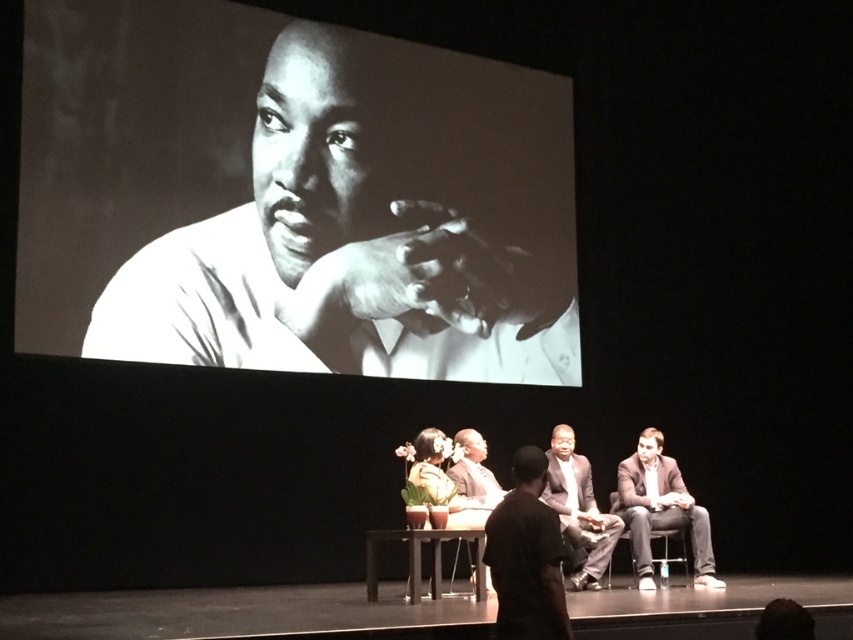
Question: Among these points, which one is farthest from the camera?

Choices:
 (A) (347, 230)
 (B) (697, 529)
 (C) (651, 532)
 (D) (556, 465)

Answer: (A)

Question: Observing the image, what is the correct spatial positioning of light brown leather jacket at lower right in reference to black fabric chair at lower right?

Choices:
 (A) left
 (B) right

Answer: (A)

Question: Does black matte shirt at center appear on the right side of dark brown suit at center?

Choices:
 (A) no
 (B) yes

Answer: (B)

Question: Can you confirm if black matte shirt at center is positioned to the right of dark brown suit at center?

Choices:
 (A) no
 (B) yes

Answer: (B)

Question: Which object is farther from the camera taking this photo?

Choices:
 (A) black fabric chair at lower right
 (B) smooth white shirt at upper left
 (C) black matte shirt at center
 (D) dark brown suit at center

Answer: (B)

Question: Which object appears closest to the camera in this image?

Choices:
 (A) dark gray suit at center
 (B) smooth white shirt at upper left
 (C) black matte shirt at center

Answer: (C)